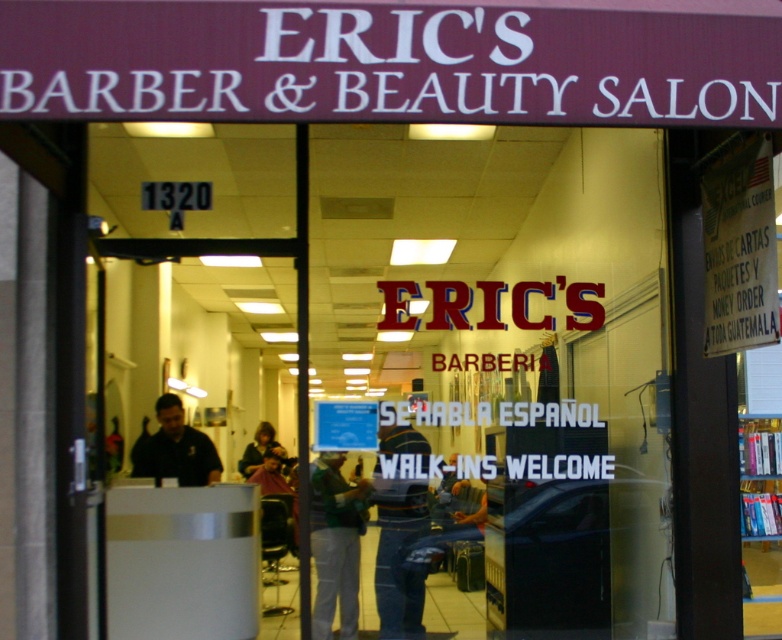
You are a customer standing at the entrance of Eric s Barber Beauty Salon. You see the green fabric shirt at center and the dark brown hair at center. How far apart are these two items?

The distance between the green fabric shirt at center and the dark brown hair at center is 4.73 meters.

You are a customer entering Eric s Barber Beauty Salon and notice two shirts hanging on a rack at the center. The green fabric shirt at center and the dark blue shirt at center. Which shirt is taller?

The green fabric shirt at center is taller than the dark blue shirt at center.